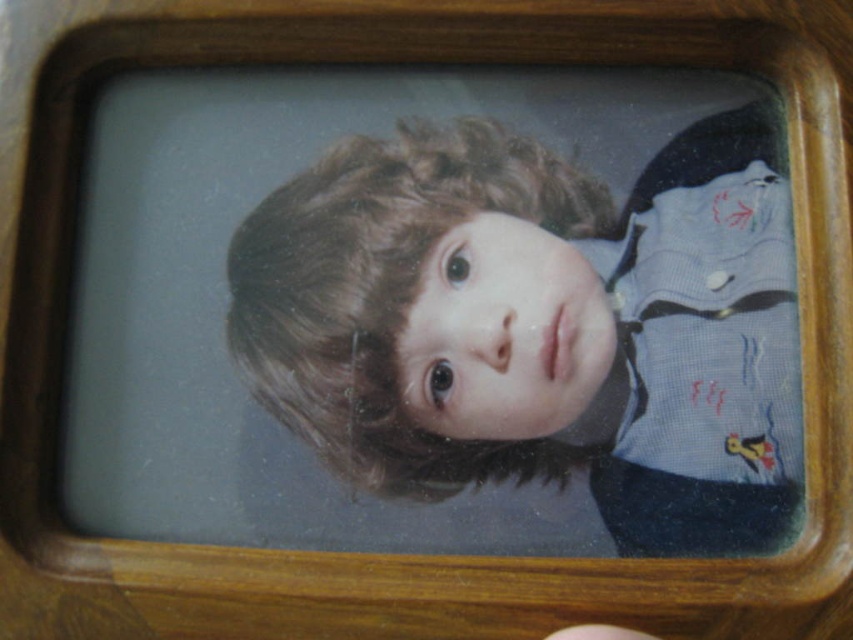
Is point (497, 428) positioned before point (605, 627)?

No, it is not.

Does point (511, 365) come in front of point (606, 625)?

That is False.

The width and height of the screenshot is (853, 640). In order to click on smooth skin face at center in this screenshot , I will do `click(503, 333)`.

Does smooth blue shirt at center appear under brown leather hand at lower center?

No, smooth blue shirt at center is not below brown leather hand at lower center.

Is point (496, 424) behind point (610, 625)?

Yes, it is.

Who is more forward, (286, 248) or (564, 632)?

Positioned in front is point (564, 632).

The height and width of the screenshot is (640, 853). In order to click on smooth blue shirt at center in this screenshot , I will do `click(467, 336)`.

Who is taller, smooth blue shirt at center or smooth skin face at center?

smooth blue shirt at center is taller.

Describe the element at coordinates (467, 336) in the screenshot. This screenshot has height=640, width=853. I see `smooth blue shirt at center` at that location.

Locate an element on the screen. smooth blue shirt at center is located at coordinates (467, 336).